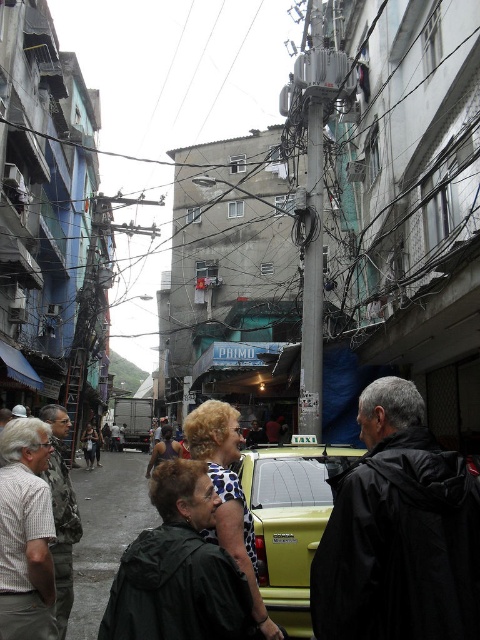
Can you confirm if checkered shirt at left is positioned below polka dot blouse at center?

Correct, checkered shirt at left is located below polka dot blouse at center.

Measure the distance from checkered shirt at left to polka dot blouse at center.

They are 2.64 meters apart.

Is point (46, 630) closer to viewer compared to point (205, 536)?

No, (46, 630) is further to viewer.

The width and height of the screenshot is (480, 640). I want to click on checkered shirt at left, so click(25, 532).

Is black matte jacket at lower right taller than polka dot blouse at center?

Incorrect, black matte jacket at lower right's height is not larger of polka dot blouse at center's.

Is black matte jacket at lower right wider than polka dot blouse at center?

Yes.

You are a GUI agent. You are given a task and a screenshot of the screen. Output one action in this format:
    pyautogui.click(x=<x>, y=<y>)
    Task: Click on the black matte jacket at lower right
    This screenshot has height=640, width=480.
    Given the screenshot: What is the action you would take?
    pyautogui.click(x=398, y=532)

Does black matte jacket at lower right appear on the left side of green matte taxi at center?

No, black matte jacket at lower right is not to the left of green matte taxi at center.

This screenshot has width=480, height=640. I want to click on black matte jacket at lower right, so click(398, 532).

Between point (404, 540) and point (264, 452), which one is positioned in front?

Point (404, 540) is more forward.

Find the location of a particular element. The image size is (480, 640). black matte jacket at lower right is located at coordinates (398, 532).